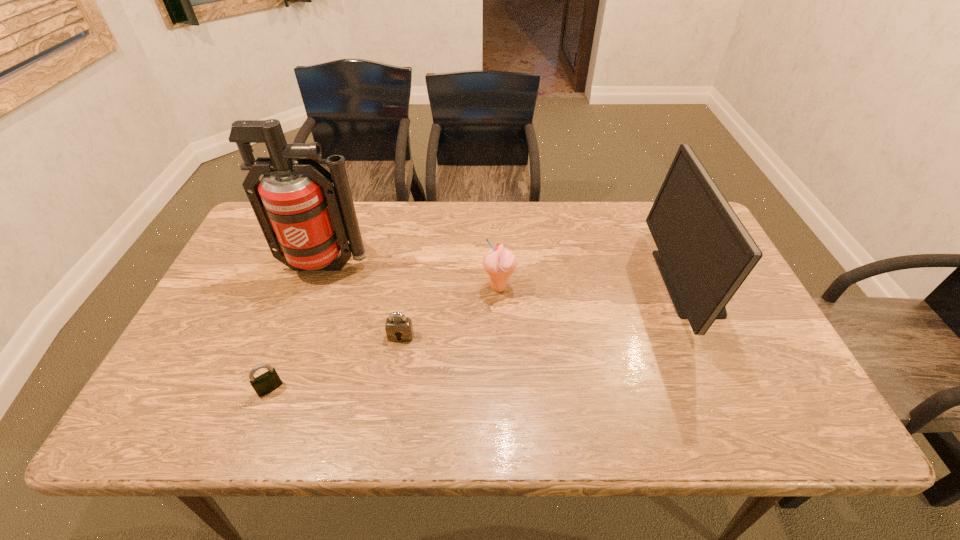
Locate an element on the screen. The image size is (960, 540). free space that is in between the icecream and the fire extinguisher is located at coordinates (412, 277).

This screenshot has width=960, height=540. In order to click on free space between the right padlock and the nearest object in this screenshot , I will do `click(335, 362)`.

Identify the location of free space between the fire extinguisher and the icecream. The image size is (960, 540). (412, 277).

The image size is (960, 540). In order to click on free space between the second tallest object and the third shortest object in this screenshot , I will do `click(595, 285)`.

Locate which object ranks in proximity to the tallest object. Please provide its 2D coordinates. Your answer should be formatted as a tuple, i.e. [(x, y)], where the tuple contains the x and y coordinates of a point satisfying the conditions above.

[(399, 328)]

You are a GUI agent. You are given a task and a screenshot of the screen. Output one action in this format:
    pyautogui.click(x=<x>, y=<y>)
    Task: Click on the object that is the fourth closest one to the nearer padlock
    The image size is (960, 540).
    Given the screenshot: What is the action you would take?
    pyautogui.click(x=705, y=253)

The height and width of the screenshot is (540, 960). Find the location of `free space that satisfies the following two spatial constraints: 1. on the back side of the nearest object; 2. on the left side of the fourth object from left to right`. free space that satisfies the following two spatial constraints: 1. on the back side of the nearest object; 2. on the left side of the fourth object from left to right is located at coordinates (308, 287).

The height and width of the screenshot is (540, 960). What are the coordinates of `vacant area that satisfies the following two spatial constraints: 1. on the front label side of the third tallest object; 2. on the right side of the fire extinguisher` in the screenshot? It's located at (318, 287).

At what (x,y) coordinates should I click in order to perform the action: click on free spot that satisfies the following two spatial constraints: 1. on the screen side of the rightmost object; 2. at the front of the third object from left to right near the keyhole. Please return your answer as a coordinate pair (x, y). The image size is (960, 540). Looking at the image, I should click on (716, 336).

You are a GUI agent. You are given a task and a screenshot of the screen. Output one action in this format:
    pyautogui.click(x=<x>, y=<y>)
    Task: Click on the free location that satisfies the following two spatial constraints: 1. on the back side of the nearer padlock; 2. on the left side of the second object from right to left
    
    Given the screenshot: What is the action you would take?
    pyautogui.click(x=308, y=287)